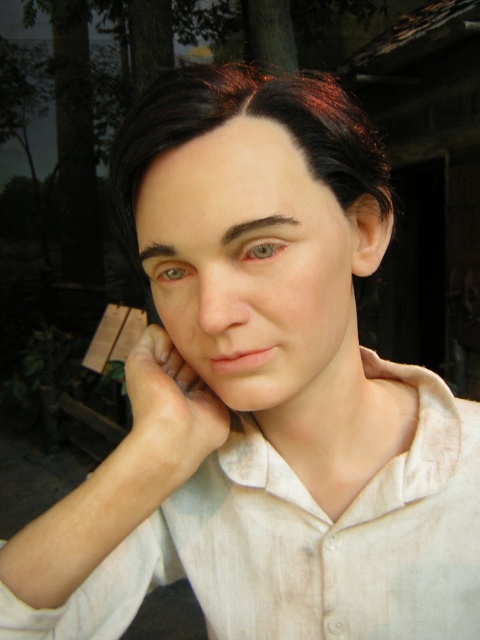
Who is more forward, [285,163] or [199,445]?

Point [285,163] is more forward.

Who is lower down, smooth skin forehead at center or smooth skin hand at center?

smooth skin hand at center

Find the location of `smooth skin forehead at center`. smooth skin forehead at center is located at coordinates (228, 186).

Image resolution: width=480 pixels, height=640 pixels. I want to click on smooth skin forehead at center, so [x=228, y=186].

Who is positioned more to the left, smooth skin face at center or dark brown shiny hair at center?

dark brown shiny hair at center is more to the left.

Can you confirm if smooth skin face at center is positioned below dark brown shiny hair at center?

Yes, smooth skin face at center is below dark brown shiny hair at center.

Measure the distance between smooth skin face at center and camera.

A distance of 12.94 inches exists between smooth skin face at center and camera.

Where is `smooth skin face at center`? The height and width of the screenshot is (640, 480). smooth skin face at center is located at coordinates (252, 269).

Does point (239, 227) lie in front of point (197, 380)?

Yes, point (239, 227) is in front of point (197, 380).

Between point (180, 339) and point (148, 474), which one is positioned in front?

Positioned in front is point (148, 474).

Is point (182, 216) in front of point (172, 360)?

Yes, it is in front of point (172, 360).

In order to click on smooth skin face at center in this screenshot , I will do `click(252, 269)`.